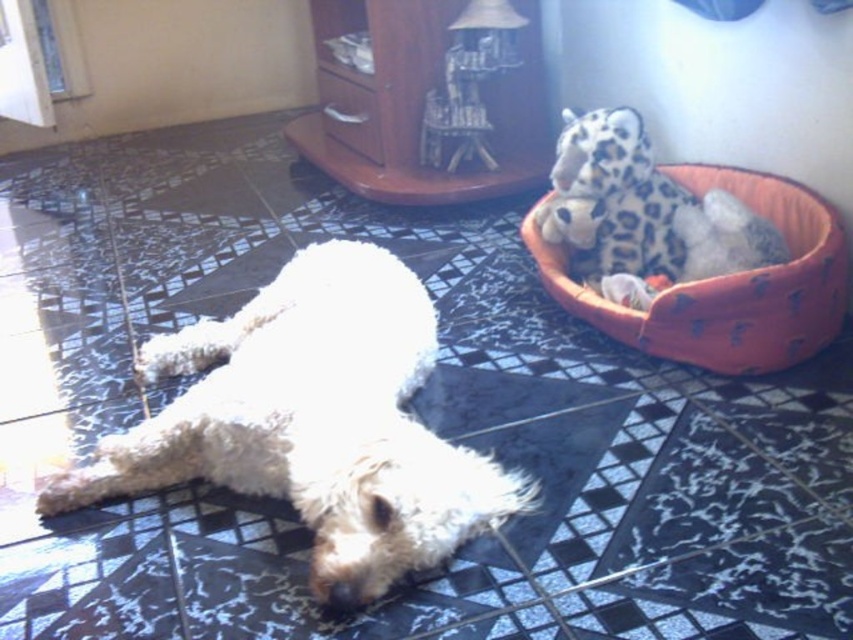
From the picture: Is white fluffy dog at center smaller than orange fabric dog bed at upper right?

No, white fluffy dog at center is not smaller than orange fabric dog bed at upper right.

Is point (78, 468) farther from camera compared to point (729, 298)?

No.

You are a GUI agent. You are given a task and a screenshot of the screen. Output one action in this format:
    pyautogui.click(x=<x>, y=<y>)
    Task: Click on the white fluffy dog at center
    The image size is (853, 640).
    Given the screenshot: What is the action you would take?
    pyautogui.click(x=315, y=422)

Which is more to the right, white fluffy dog at center or spotted plush toy at upper right?

Positioned to the right is spotted plush toy at upper right.

Who is lower down, white fluffy dog at center or spotted plush toy at upper right?

white fluffy dog at center

Measure the distance between white fluffy dog at center and camera.

1.19 meters

Identify the location of white fluffy dog at center. This screenshot has height=640, width=853. (315, 422).

Which is below, orange fabric dog bed at upper right or spotted plush toy at upper right?

orange fabric dog bed at upper right

Looking at this image, does orange fabric dog bed at upper right appear on the right side of spotted plush toy at upper right?

Correct, you'll find orange fabric dog bed at upper right to the right of spotted plush toy at upper right.

Is point (741, 323) positioned behind point (567, 205)?

No.

I want to click on orange fabric dog bed at upper right, so click(x=729, y=284).